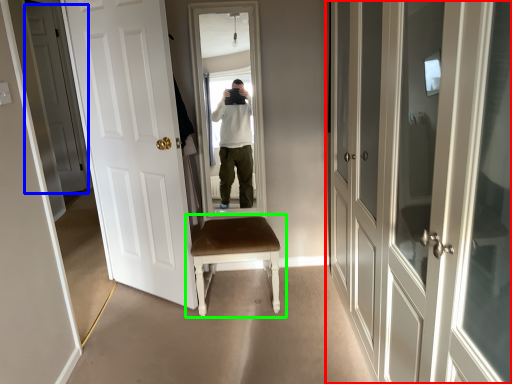
Question: Which object is positioned closest to door (highlighted by a red box)? Select from door (highlighted by a blue box) and chair (highlighted by a green box).

Choices:
 (A) door
 (B) chair

Answer: (B)